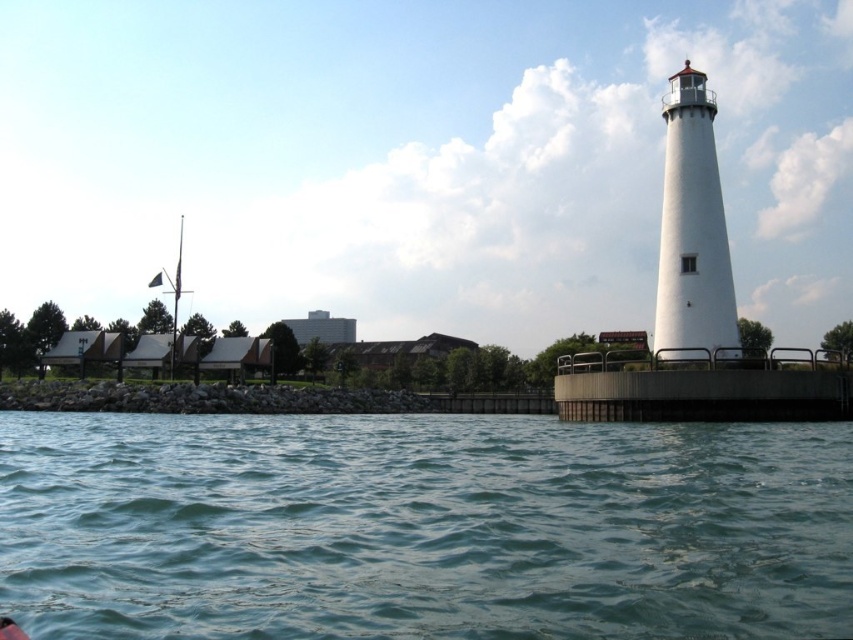
Question: Among these points, which one is farthest from the camera?

Choices:
 (A) (682, 348)
 (B) (556, 451)

Answer: (A)

Question: Does greenish-blue water at lower center lie behind white smooth lighthouse at right?

Choices:
 (A) yes
 (B) no

Answer: (B)

Question: Which point is farther to the camera?

Choices:
 (A) greenish-blue water at lower center
 (B) white smooth lighthouse at right

Answer: (B)

Question: Can you confirm if greenish-blue water at lower center is bigger than white smooth lighthouse at right?

Choices:
 (A) no
 (B) yes

Answer: (B)

Question: Can you confirm if greenish-blue water at lower center is positioned to the right of white smooth lighthouse at right?

Choices:
 (A) yes
 (B) no

Answer: (B)

Question: Among these objects, which one is farthest from the camera?

Choices:
 (A) white smooth lighthouse at right
 (B) greenish-blue water at lower center

Answer: (A)